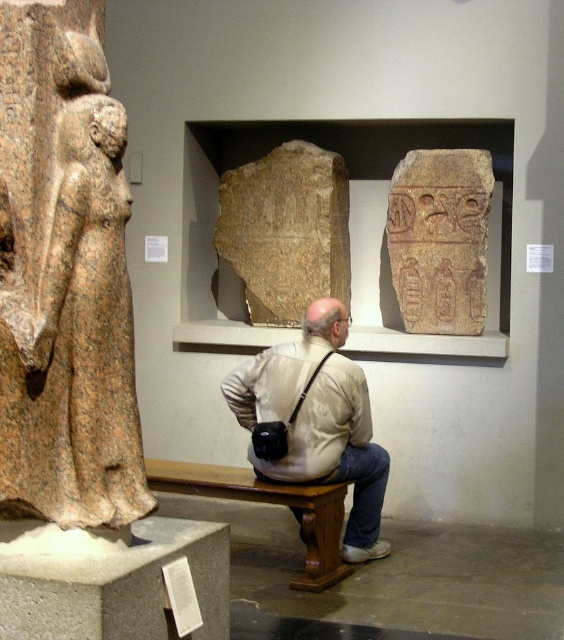
You are a tour guide in the museum and need to ensure visitors can see the artifacts clearly. The light beige shirt at center and the brown wooden bench at lower center are in the viewing area. Which object is taller and might block the view of the artifacts?

The light beige shirt at center is much taller than the brown wooden bench at lower center, so it might block the view of the artifacts.